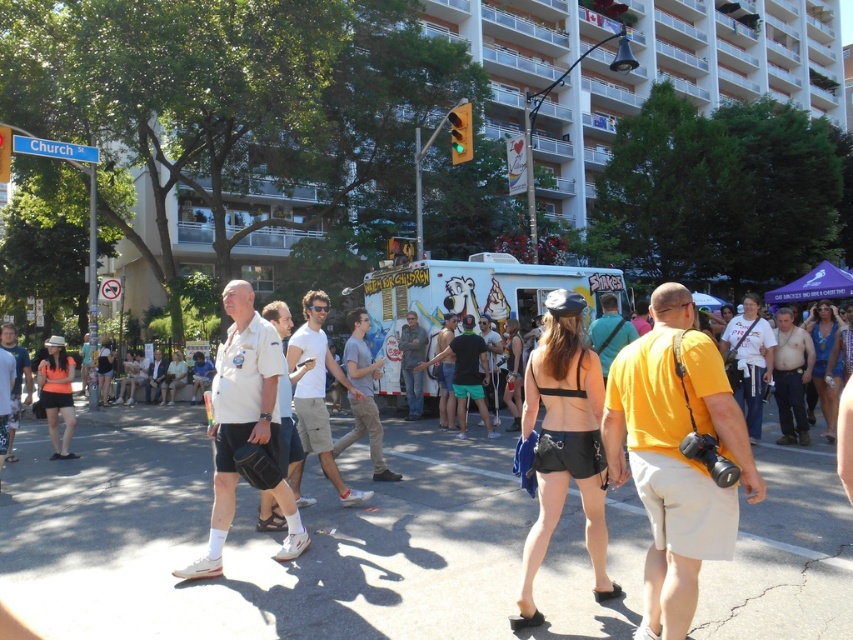
Is matte black shorts at left to the left of denim jacket at center from the viewer's perspective?

Indeed, matte black shorts at left is positioned on the left side of denim jacket at center.

Does matte black shorts at left appear on the right side of denim jacket at center?

No, matte black shorts at left is not to the right of denim jacket at center.

Between point (70, 435) and point (422, 337), which one is positioned in front?

Point (70, 435) is in front.

You are a GUI agent. You are given a task and a screenshot of the screen. Output one action in this format:
    pyautogui.click(x=<x>, y=<y>)
    Task: Click on the matte black shorts at left
    
    Given the screenshot: What is the action you would take?
    pyautogui.click(x=57, y=394)

Can you confirm if yellow cotton shirt at center is positioned to the right of white painted ice cream truck at center?

In fact, yellow cotton shirt at center is to the left of white painted ice cream truck at center.

Looking at this image, who is more distant from viewer, (689, 596) or (567, 285)?

Positioned behind is point (567, 285).

The height and width of the screenshot is (640, 853). Identify the location of yellow cotton shirt at center. (675, 458).

Looking at this image, is yellow cotton shirt at center bigger than matte black shorts at left?

Actually, yellow cotton shirt at center might be smaller than matte black shorts at left.

Which is more to the right, yellow cotton shirt at center or matte black shorts at left?

Positioned to the right is yellow cotton shirt at center.

Who is more distant from viewer, (682, 289) or (51, 424)?

Point (51, 424)

You are a GUI agent. You are given a task and a screenshot of the screen. Output one action in this format:
    pyautogui.click(x=<x>, y=<y>)
    Task: Click on the yellow cotton shirt at center
    
    Given the screenshot: What is the action you would take?
    pyautogui.click(x=675, y=458)